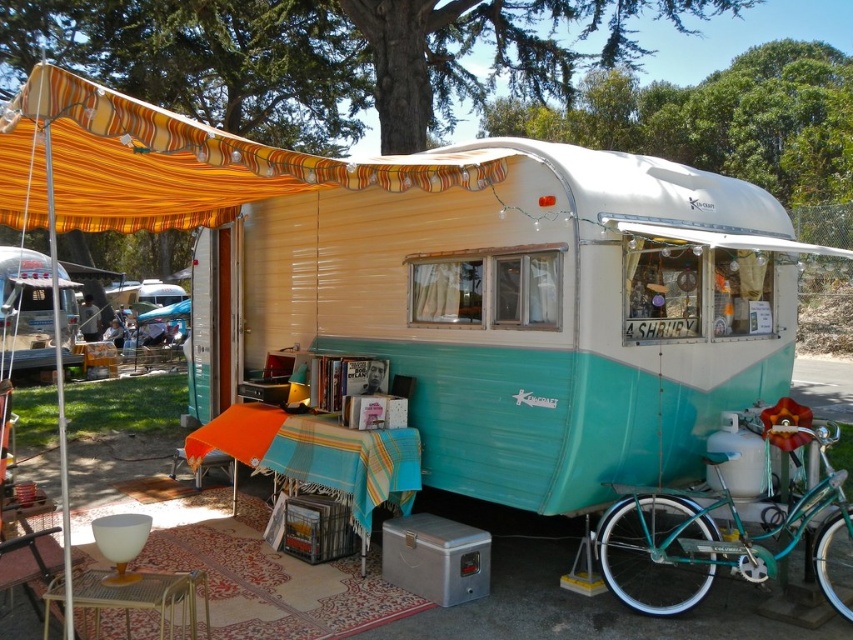
Is teal glossy trailer at center wider than teal metallic bicycle at lower right?

Correct, the width of teal glossy trailer at center exceeds that of teal metallic bicycle at lower right.

Measure the distance between teal glossy trailer at center and camera.

teal glossy trailer at center and camera are 11.98 feet apart from each other.

This screenshot has width=853, height=640. I want to click on teal glossy trailer at center, so click(537, 310).

From the picture: Does orange striped fabric canopy at upper left have a greater width compared to teal metallic bicycle at lower right?

Indeed, orange striped fabric canopy at upper left has a greater width compared to teal metallic bicycle at lower right.

Between orange striped fabric canopy at upper left and teal metallic bicycle at lower right, which one appears on the left side from the viewer's perspective?

orange striped fabric canopy at upper left

What do you see at coordinates (173, 163) in the screenshot? This screenshot has height=640, width=853. I see `orange striped fabric canopy at upper left` at bounding box center [173, 163].

Where is `orange striped fabric canopy at upper left`? This screenshot has height=640, width=853. orange striped fabric canopy at upper left is located at coordinates (173, 163).

Is point (260, 147) positioned behind point (123, 104)?

Yes, it is.

Is point (572, 368) positioned before point (483, 188)?

Yes, it is in front of point (483, 188).

Who is more forward, [750,273] or [86,118]?

Point [86,118]

Find the location of a particular element. teal glossy trailer at center is located at coordinates (537, 310).